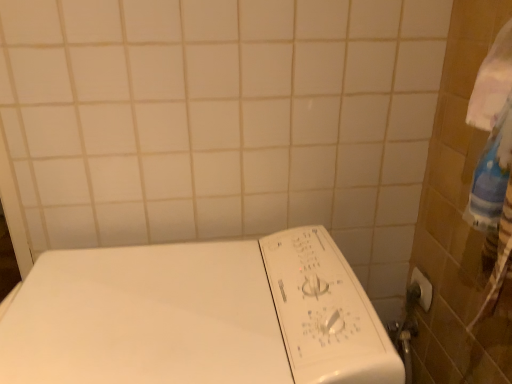
At what (x,y) coordinates should I click in order to perform the action: click on white plastic washing machine at lower left. Please return your answer as a coordinate pair (x, y). The width and height of the screenshot is (512, 384). Looking at the image, I should click on (198, 316).

Describe the element at coordinates (198, 316) in the screenshot. I see `white plastic washing machine at lower left` at that location.

This screenshot has height=384, width=512. In order to click on white plastic washing machine at lower left in this screenshot , I will do `click(198, 316)`.